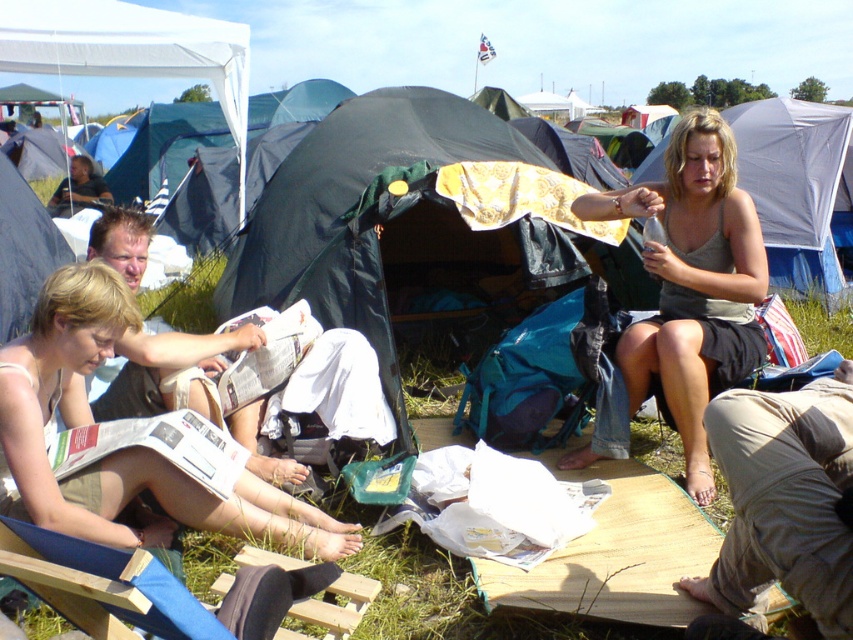
Question: Can you confirm if matte white newspaper at lower left is wider than matte gray tank top at center?

Choices:
 (A) yes
 (B) no

Answer: (A)

Question: Does matte gray tent at upper right have a greater width compared to blue fabric folding chair at lower left?

Choices:
 (A) yes
 (B) no

Answer: (A)

Question: Which point is closer to the camera?

Choices:
 (A) (68, 548)
 (B) (438, 225)
 (C) (692, 298)
 (D) (73, 332)

Answer: (A)

Question: Where is black fabric tent at center located in relation to blue fabric folding chair at lower left in the image?

Choices:
 (A) below
 (B) above

Answer: (B)

Question: Considering the real-world distances, which object is closest to the matte gray tank top at center?

Choices:
 (A) matte white newspaper at lower left
 (B) blue fabric folding chair at lower left
 (C) black fabric tent at center
 (D) matte gray tent at upper right

Answer: (C)

Question: Which of the following is the closest to the observer?

Choices:
 (A) matte gray tank top at center
 (B) matte gray tent at upper right
 (C) black fabric tent at center

Answer: (A)